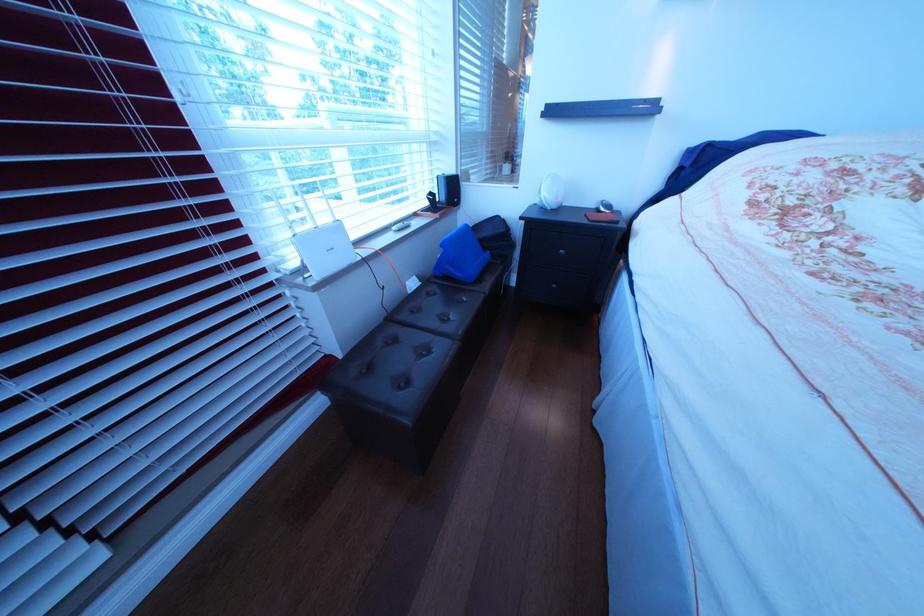
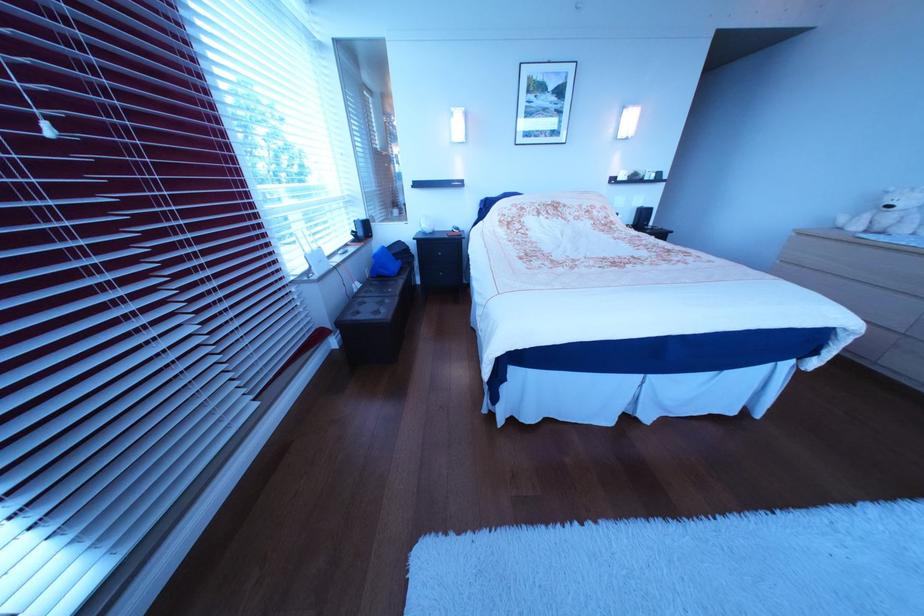
In the second image, find the point that corresponds to point 456,248 in the first image.

(388, 260)